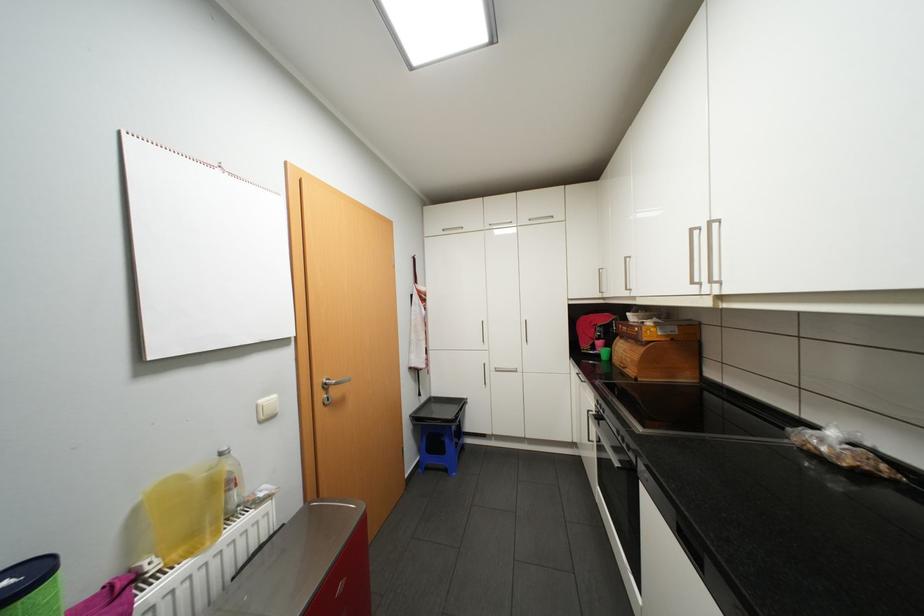
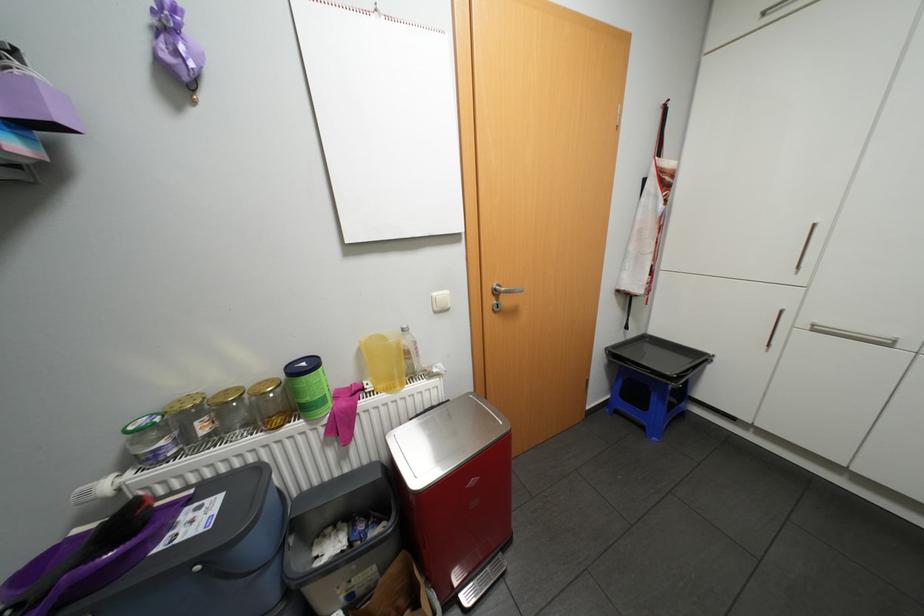
The first image is from the beginning of the video and the second image is from the end. How did the camera likely rotate when shooting the video?

The camera's rotation is toward left-down.